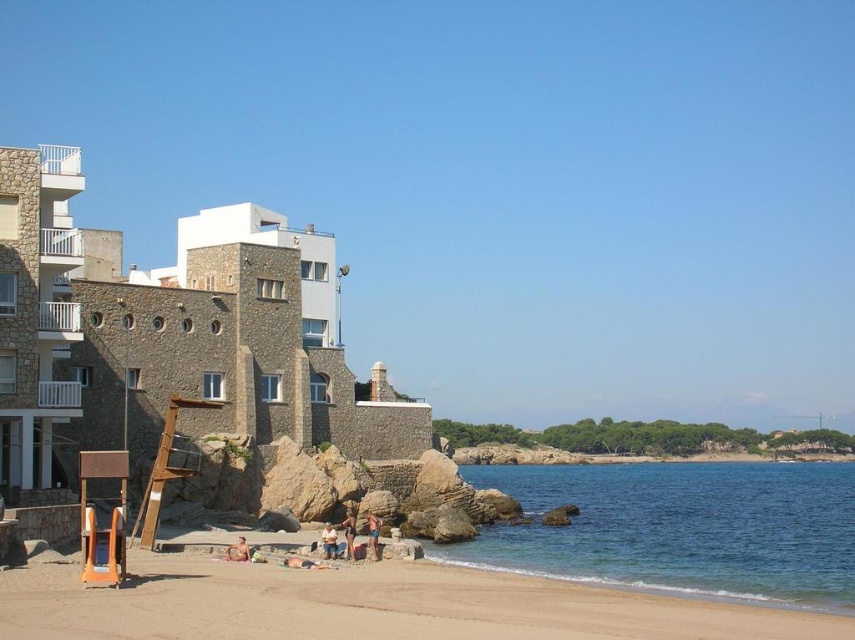
Question: Which object appears closest to the camera in this image?

Choices:
 (A) sandy beach at lower center
 (B) matte skin person at center
 (C) blue denim shorts at lower center

Answer: (A)

Question: Does stone textured building at left appear on the right side of clear blue water at lower right?

Choices:
 (A) no
 (B) yes

Answer: (A)

Question: Which point appears farthest from the camera in this image?

Choices:
 (A) (240, 561)
 (B) (612, 637)
 (C) (494, 566)
 (D) (346, 554)

Answer: (C)

Question: Does sandy beach at lower center appear under blue denim shorts at lower center?

Choices:
 (A) no
 (B) yes

Answer: (A)

Question: Based on their relative distances, which object is farther from the blue denim shorts at lower center?

Choices:
 (A) matte skin person at center
 (B) tan skin person at center
 (C) stone textured building at left
 (D) sandy beach at lower center

Answer: (C)

Question: Observing the image, what is the correct spatial positioning of sandy beach at lower center in reference to tan skin person at center?

Choices:
 (A) below
 (B) above

Answer: (B)